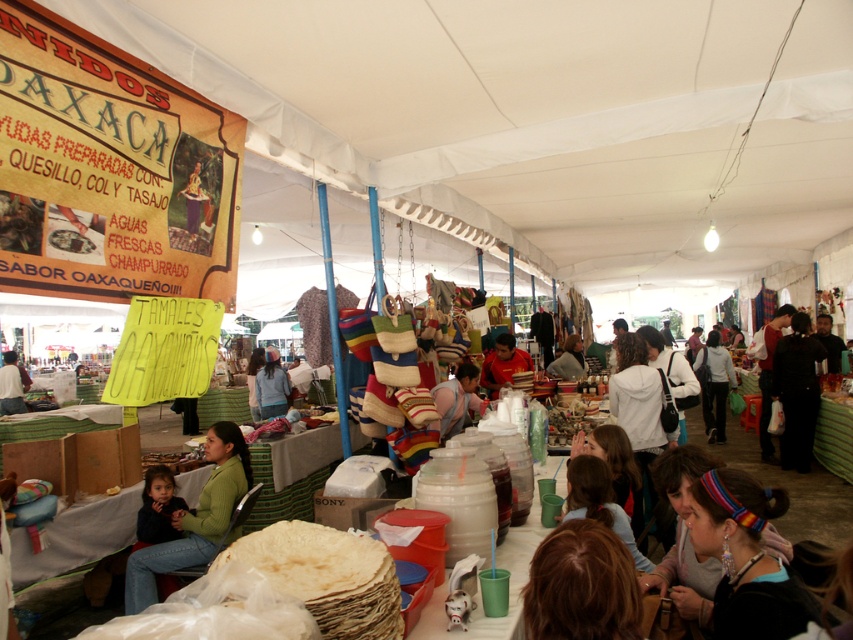
Does point (491, 362) lie in front of point (270, 380)?

Yes, it is.

Between point (488, 372) and point (260, 371), which one is positioned behind?

The point (260, 371) is more distant.

Find the location of a particular element. The image size is (853, 640). matte red shirt at center is located at coordinates click(503, 364).

This screenshot has width=853, height=640. What do you see at coordinates (109, 170) in the screenshot? I see `matte paper signboard at upper left` at bounding box center [109, 170].

Find the location of a particular element. Image resolution: width=853 pixels, height=640 pixels. matte paper signboard at upper left is located at coordinates (109, 170).

Is matte paper signboard at upper left wider than blue fabric jacket at center?

No.

Can you confirm if matte paper signboard at upper left is thinner than blue fabric jacket at center?

Indeed, matte paper signboard at upper left has a lesser width compared to blue fabric jacket at center.

Is point (12, 230) positioned after point (270, 362)?

No, (12, 230) is in front of (270, 362).

The image size is (853, 640). Identify the location of matte paper signboard at upper left. (109, 170).